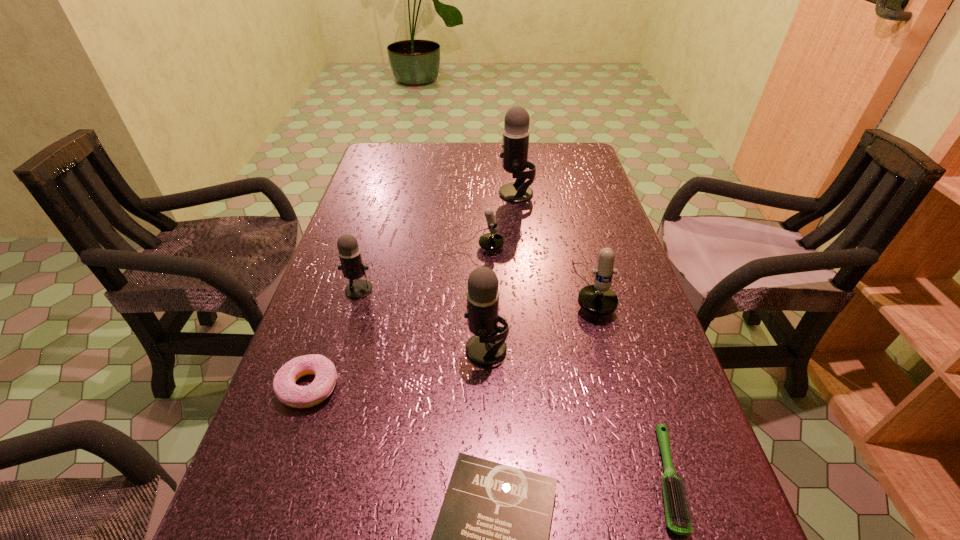
Find the location of a particular element. This screenshot has height=540, width=960. free space between the leftmost gray microphone and the third shortest object is located at coordinates (334, 338).

This screenshot has height=540, width=960. In order to click on free spot between the farthest microphone and the bigger white microphone in this screenshot , I will do `click(553, 241)`.

I want to click on unoccupied position between the doughnut and the hairbrush, so click(x=488, y=433).

Locate an element on the screen. The image size is (960, 540). unoccupied position between the bigger white microphone and the hairbrush is located at coordinates (629, 384).

Find the location of a particular element. This screenshot has width=960, height=540. empty space between the tallest microphone and the leftmost microphone is located at coordinates (438, 241).

Find the location of `free space between the nearest gray microphone and the farthest object`. free space between the nearest gray microphone and the farthest object is located at coordinates (501, 272).

I want to click on the fourth closest object to the biggest gray microphone, so click(486, 347).

Locate which object ranks seventh in proximity to the doughnut. Please provide its 2D coordinates. Your answer should be formatted as a tuple, i.e. [(x, y)], where the tuple contains the x and y coordinates of a point satisfying the conditions above.

[(516, 132)]

Locate which microphone ranks second in proximity to the nearer white microphone. Please provide its 2D coordinates. Your answer should be formatted as a tuple, i.e. [(x, y)], where the tuple contains the x and y coordinates of a point satisfying the conditions above.

[(486, 347)]

At what (x,y) coordinates should I click in order to perform the action: click on microphone that is the fourth closest one to the leftmost microphone. Please return your answer as a coordinate pair (x, y). Image resolution: width=960 pixels, height=540 pixels. Looking at the image, I should click on (599, 299).